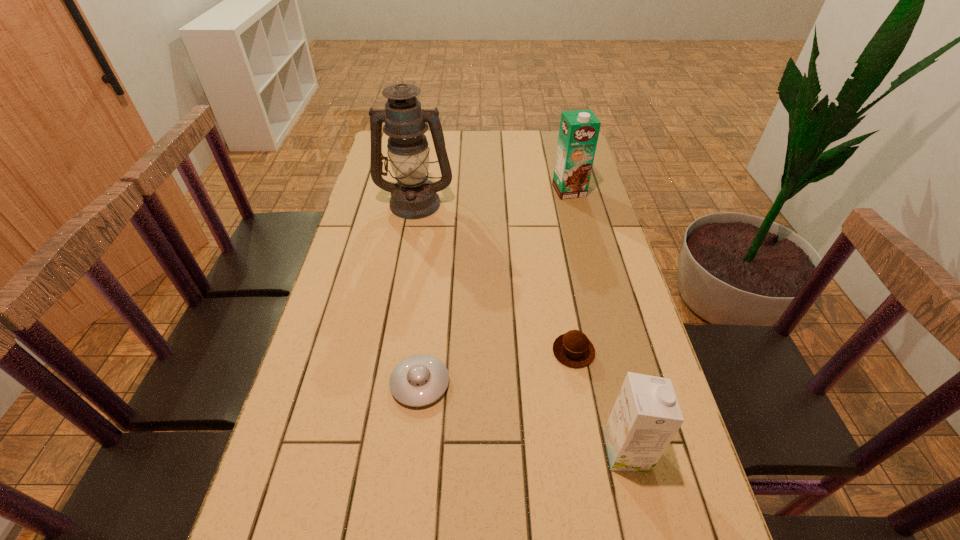
Find the location of a particular element. The height and width of the screenshot is (540, 960). vacant space located 0.270m on the front of the muffin is located at coordinates (598, 489).

The width and height of the screenshot is (960, 540). Find the location of `free region located on the back of the saucer`. free region located on the back of the saucer is located at coordinates (427, 316).

This screenshot has width=960, height=540. Find the location of `object at the left edge`. object at the left edge is located at coordinates (413, 196).

In order to click on muffin that is at the right edge in this screenshot , I will do `click(573, 349)`.

The width and height of the screenshot is (960, 540). In order to click on free space at the far edge in this screenshot , I will do `click(503, 147)`.

Find the location of `vacant space at the left edge`. vacant space at the left edge is located at coordinates (348, 298).

Image resolution: width=960 pixels, height=540 pixels. Find the location of `free space at the right edge`. free space at the right edge is located at coordinates (600, 400).

This screenshot has height=540, width=960. Find the location of `vacant area between the nearest object and the saucer`. vacant area between the nearest object and the saucer is located at coordinates (523, 417).

I want to click on unoccupied position between the second shortest object and the nearest object, so click(600, 401).

I want to click on free space between the saucer and the oil lamp, so click(418, 293).